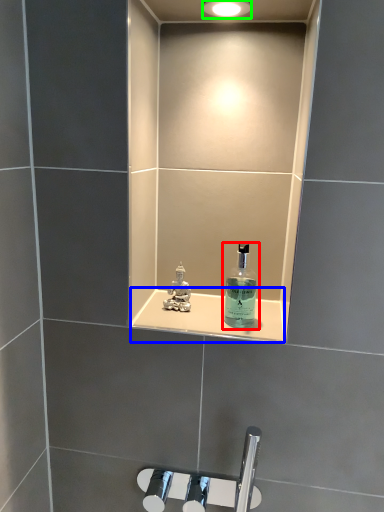
Question: Considering the real-world distances, which object is closest to bottle (highlighted by a red box)? ledge (highlighted by a blue box) or light fixture (highlighted by a green box).

Choices:
 (A) ledge
 (B) light fixture

Answer: (A)